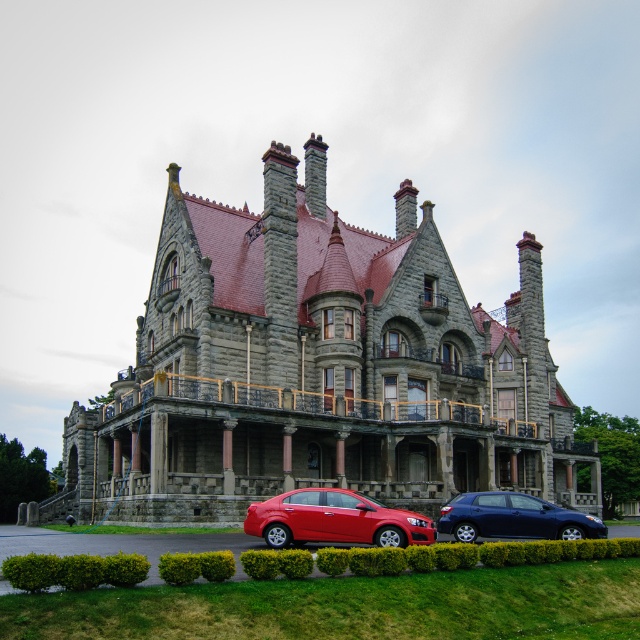
Question: Does matte red sedan at center appear under metallic blue hatchback at lower center?

Choices:
 (A) yes
 (B) no

Answer: (B)

Question: Is the position of stone mansion at center less distant than that of green grass at lower center?

Choices:
 (A) yes
 (B) no

Answer: (B)

Question: Which point is farther to the camera?

Choices:
 (A) (465, 468)
 (B) (358, 516)
 (C) (92, 632)

Answer: (A)

Question: Can you confirm if matte red sedan at center is positioned above metallic blue hatchback at lower center?

Choices:
 (A) no
 (B) yes

Answer: (B)

Question: Which point appears closest to the camera in this image?

Choices:
 (A) (148, 384)
 (B) (349, 618)
 (C) (304, 516)

Answer: (B)

Question: Which is farther from the matte red sedan at center?

Choices:
 (A) metallic blue hatchback at lower center
 (B) stone mansion at center

Answer: (B)